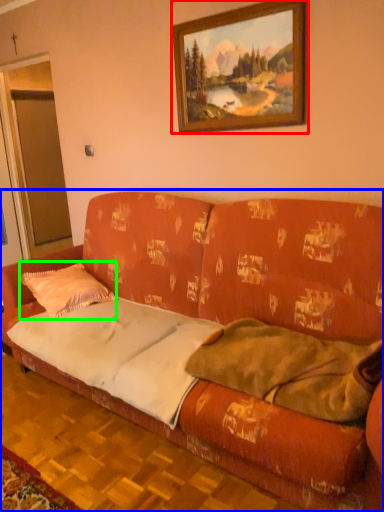
Question: Which object is positioned closest to picture frame (highlighted by a red box)? Select from studio couch (highlighted by a blue box) and throw pillow (highlighted by a green box).

Choices:
 (A) studio couch
 (B) throw pillow

Answer: (A)